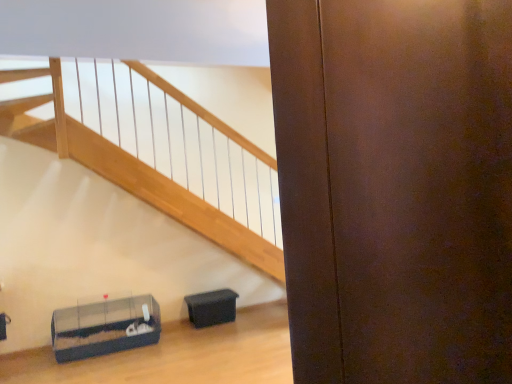
Question: Which direction should I rotate to face black plastic container at lower center, placed as the 2th furniture when sorted from left to right, — up or down?

Choices:
 (A) up
 (B) down

Answer: (B)

Question: From a real-world perspective, is black plastic container at lower center, placed as the 2th furniture when sorted from left to right, beneath clear plastic cage at lower left, the first furniture when ordered from left to right?

Choices:
 (A) no
 (B) yes

Answer: (B)

Question: From the image's perspective, is black plastic container at lower center, the 1th furniture viewed from the right, beneath clear plastic cage at lower left, which appears as the 2th furniture when viewed from the right?

Choices:
 (A) no
 (B) yes

Answer: (A)

Question: Does black plastic container at lower center, placed as the 2th furniture when sorted from left to right, lie in front of clear plastic cage at lower left, which appears as the 2th furniture when viewed from the right?

Choices:
 (A) yes
 (B) no

Answer: (B)

Question: Is black plastic container at lower center, the 1th furniture viewed from the right, to the left of clear plastic cage at lower left, the first furniture when ordered from left to right, from the viewer's perspective?

Choices:
 (A) yes
 (B) no

Answer: (B)

Question: Is clear plastic cage at lower left, which appears as the 2th furniture when viewed from the right, surrounded by black plastic container at lower center, the 1th furniture viewed from the right?

Choices:
 (A) yes
 (B) no

Answer: (B)

Question: Is black plastic container at lower center, placed as the 2th furniture when sorted from left to right, aimed at clear plastic cage at lower left, which appears as the 2th furniture when viewed from the right?

Choices:
 (A) no
 (B) yes

Answer: (A)

Question: Can you confirm if clear plastic cage at lower left, the first furniture when ordered from left to right, is wider than black plastic container at lower center, placed as the 2th furniture when sorted from left to right?

Choices:
 (A) yes
 (B) no

Answer: (A)

Question: Is clear plastic cage at lower left, the first furniture when ordered from left to right, turned away from black plastic container at lower center, the 1th furniture viewed from the right?

Choices:
 (A) no
 (B) yes

Answer: (A)

Question: Can you confirm if clear plastic cage at lower left, which appears as the 2th furniture when viewed from the right, is smaller than black plastic container at lower center, placed as the 2th furniture when sorted from left to right?

Choices:
 (A) yes
 (B) no

Answer: (B)

Question: Considering the relative positions of clear plastic cage at lower left, which appears as the 2th furniture when viewed from the right, and black plastic container at lower center, placed as the 2th furniture when sorted from left to right, in the image provided, is clear plastic cage at lower left, which appears as the 2th furniture when viewed from the right, behind black plastic container at lower center, placed as the 2th furniture when sorted from left to right,?

Choices:
 (A) yes
 (B) no

Answer: (B)

Question: From the image's perspective, is clear plastic cage at lower left, which appears as the 2th furniture when viewed from the right, located beneath black plastic container at lower center, the 1th furniture viewed from the right?

Choices:
 (A) no
 (B) yes

Answer: (B)

Question: Is the depth of clear plastic cage at lower left, which appears as the 2th furniture when viewed from the right, less than that of black plastic container at lower center, placed as the 2th furniture when sorted from left to right?

Choices:
 (A) no
 (B) yes

Answer: (B)

Question: Considering their positions, is black plastic container at lower center, the 1th furniture viewed from the right, located in front of or behind clear plastic cage at lower left, which appears as the 2th furniture when viewed from the right?

Choices:
 (A) behind
 (B) front

Answer: (A)